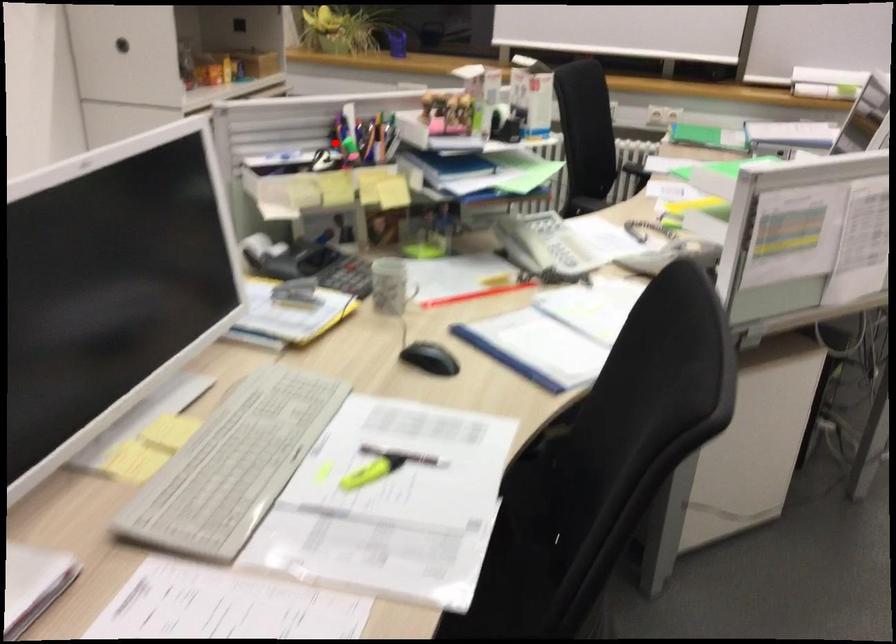
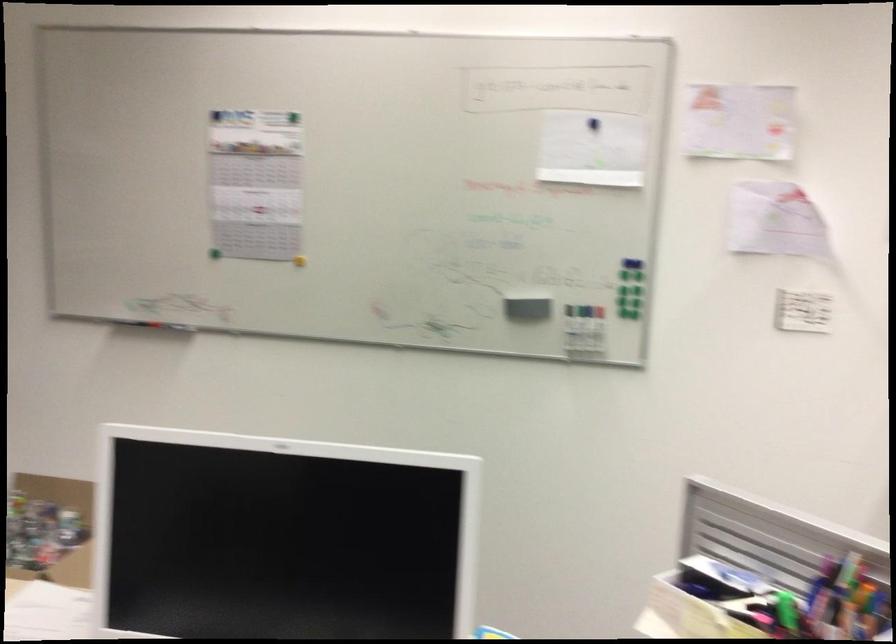
The point at the highlighted location is marked in the first image. Where is the corresponding point in the second image?

(787, 610)